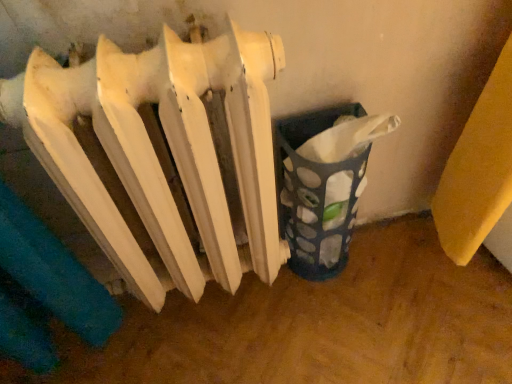
Locate an element on the screen. The image size is (512, 384). free spot in front of translucent plastic basket at lower right is located at coordinates (340, 329).